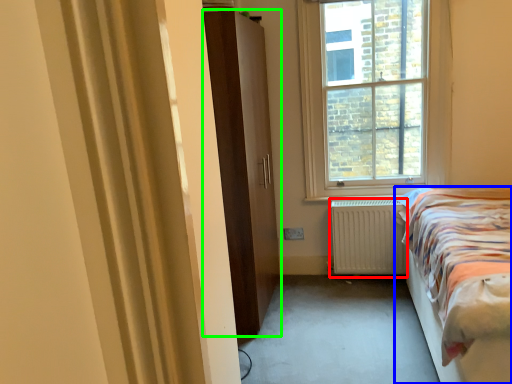
Question: Based on their relative distances, which object is farther from radiator (highlighted by a red box)? Choose from bed (highlighted by a blue box) and door (highlighted by a green box).

Choices:
 (A) bed
 (B) door

Answer: (B)